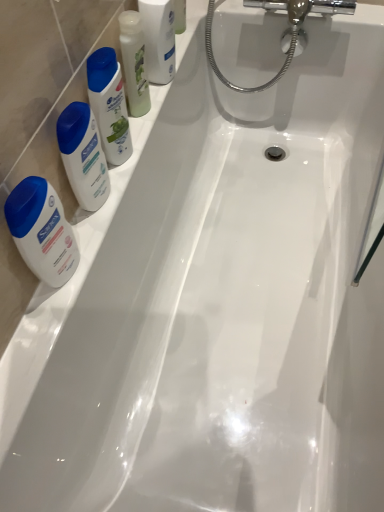
Question: Is translucent plastic mouthwash at upper left, marked as the second mouthwash in a right-to-left arrangement, completely or partially inside matte white shampoo at left, arranged as the 2th cleaning product when viewed from the top?

Choices:
 (A) no
 (B) yes

Answer: (A)

Question: From a real-world perspective, is matte white shampoo at left, arranged as the 2th cleaning product when viewed from the top, located beneath translucent plastic mouthwash at upper left, marked as the second mouthwash in a right-to-left arrangement?

Choices:
 (A) no
 (B) yes

Answer: (B)

Question: Does matte white shampoo at left, the 1th cleaning product when ordered from bottom to top, lie behind translucent plastic mouthwash at upper left, which is the 1th mouthwash from left to right?

Choices:
 (A) yes
 (B) no

Answer: (B)

Question: Would you say matte white shampoo at left, arranged as the 2th cleaning product when viewed from the top, is a long distance from translucent plastic mouthwash at upper left, marked as the second mouthwash in a right-to-left arrangement?

Choices:
 (A) no
 (B) yes

Answer: (A)

Question: Can you confirm if matte white shampoo at left, the 1th cleaning product when ordered from bottom to top, is bigger than translucent plastic mouthwash at upper left, marked as the second mouthwash in a right-to-left arrangement?

Choices:
 (A) no
 (B) yes

Answer: (B)

Question: Is clear plastic mouthwash at upper left, which ranks as the 2th mouthwash in left-to-right order, to the left or to the right of matte white shampoo at left, arranged as the 2th cleaning product when viewed from the top, in the image?

Choices:
 (A) right
 (B) left

Answer: (A)

Question: Is clear plastic mouthwash at upper left, which ranks as the 2th mouthwash in left-to-right order, situated inside matte white shampoo at left, arranged as the 2th cleaning product when viewed from the top, or outside?

Choices:
 (A) outside
 (B) inside

Answer: (A)

Question: Relative to matte white shampoo at left, arranged as the 2th cleaning product when viewed from the top, is clear plastic mouthwash at upper left, which is the 1th mouthwash from right to left, in front or behind?

Choices:
 (A) front
 (B) behind

Answer: (B)

Question: In terms of width, does clear plastic mouthwash at upper left, which is the 1th mouthwash from right to left, look wider or thinner when compared to matte white shampoo at left, the 1th cleaning product when ordered from bottom to top?

Choices:
 (A) thin
 (B) wide

Answer: (B)

Question: Relative to white glossy shampoo bottle at upper left, the second cleaning product ordered from the bottom, is translucent plastic mouthwash at upper left, which is the 1th mouthwash from left to right, in front or behind?

Choices:
 (A) behind
 (B) front

Answer: (A)

Question: Considering the positions of translucent plastic mouthwash at upper left, marked as the second mouthwash in a right-to-left arrangement, and white glossy shampoo bottle at upper left, the second cleaning product ordered from the bottom, in the image, is translucent plastic mouthwash at upper left, marked as the second mouthwash in a right-to-left arrangement, bigger or smaller than white glossy shampoo bottle at upper left, the second cleaning product ordered from the bottom,?

Choices:
 (A) big
 (B) small

Answer: (B)

Question: Considering the positions of translucent plastic mouthwash at upper left, marked as the second mouthwash in a right-to-left arrangement, and white glossy shampoo bottle at upper left, acting as the 1th cleaning product starting from the top, in the image, is translucent plastic mouthwash at upper left, marked as the second mouthwash in a right-to-left arrangement, taller or shorter than white glossy shampoo bottle at upper left, acting as the 1th cleaning product starting from the top,?

Choices:
 (A) short
 (B) tall

Answer: (A)

Question: Is point [119, 39] closer or farther from the camera than point [105, 105]?

Choices:
 (A) farther
 (B) closer

Answer: (A)

Question: In terms of size, does matte white shampoo at left, arranged as the 2th cleaning product when viewed from the top, appear bigger or smaller than clear plastic mouthwash at upper left, which ranks as the 2th mouthwash in left-to-right order?

Choices:
 (A) big
 (B) small

Answer: (B)

Question: From the image's perspective, is matte white shampoo at left, arranged as the 2th cleaning product when viewed from the top, located above or below clear plastic mouthwash at upper left, which ranks as the 2th mouthwash in left-to-right order?

Choices:
 (A) below
 (B) above

Answer: (A)